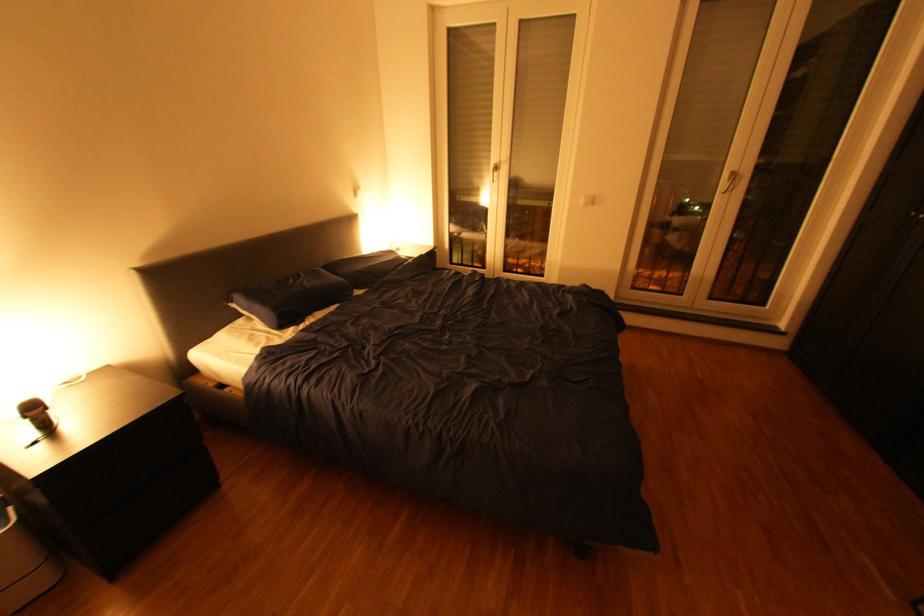
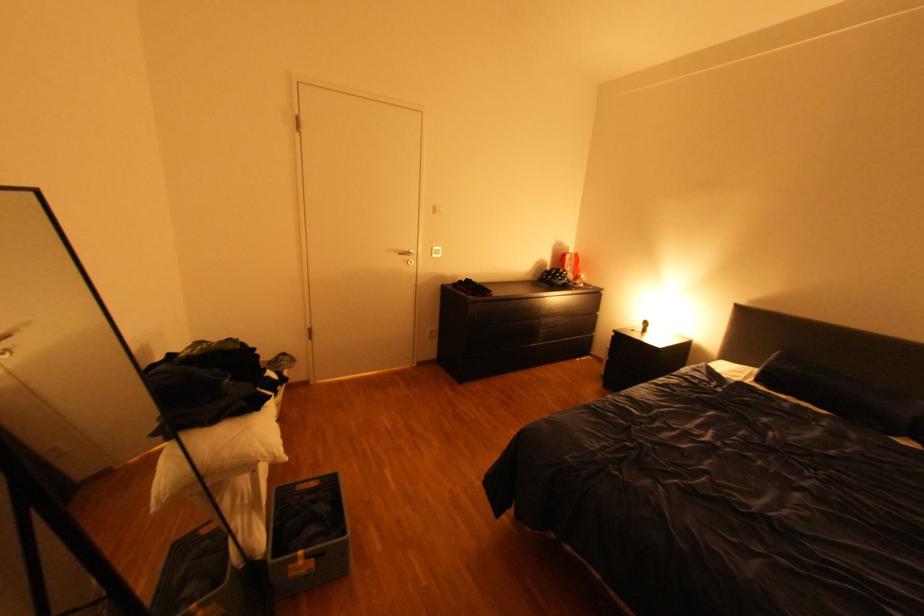
In the second image, find the point that corresponds to [301,328] in the first image.

(771, 387)